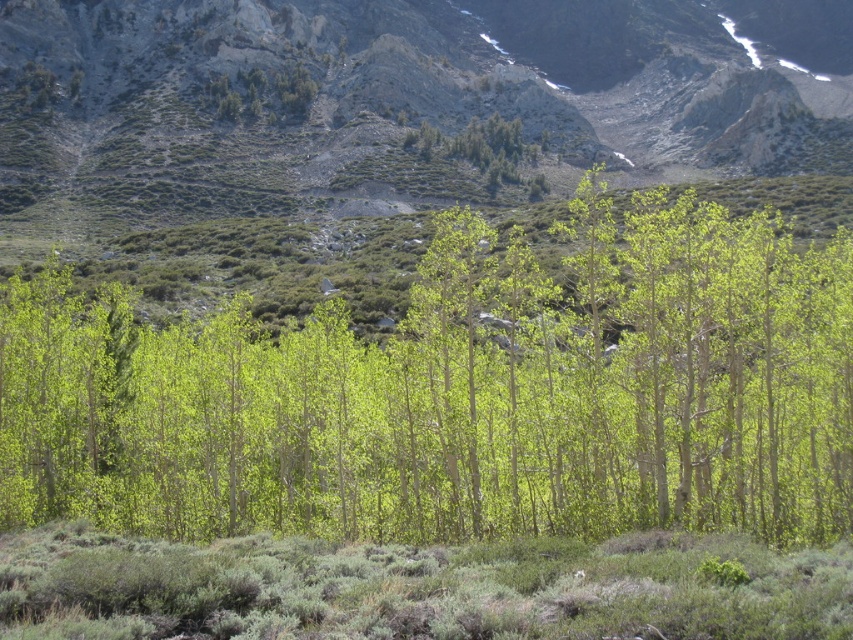
Question: Is green leafy trees at center to the left of green leafy tree at upper center from the viewer's perspective?

Choices:
 (A) yes
 (B) no

Answer: (B)

Question: Can you confirm if green matte trees at center is positioned below green leafy trees at center?

Choices:
 (A) no
 (B) yes

Answer: (B)

Question: Considering the real-world distances, which object is closest to the green leafy tree at upper center?

Choices:
 (A) green leafy trees at center
 (B) green matte trees at center

Answer: (A)

Question: Among these objects, which one is nearest to the camera?

Choices:
 (A) green leafy trees at center
 (B) green leafy tree at upper center

Answer: (A)

Question: Estimate the real-world distances between objects in this image. Which object is closer to the green matte trees at center?

Choices:
 (A) green leafy tree at upper center
 (B) green leafy trees at center

Answer: (B)

Question: Can you confirm if green matte trees at center is positioned below green leafy trees at center?

Choices:
 (A) yes
 (B) no

Answer: (A)